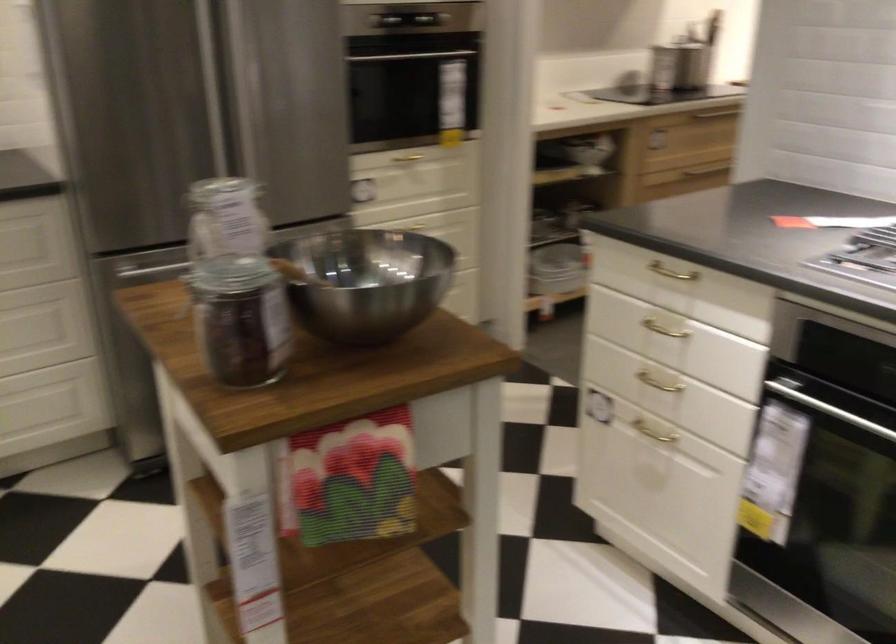
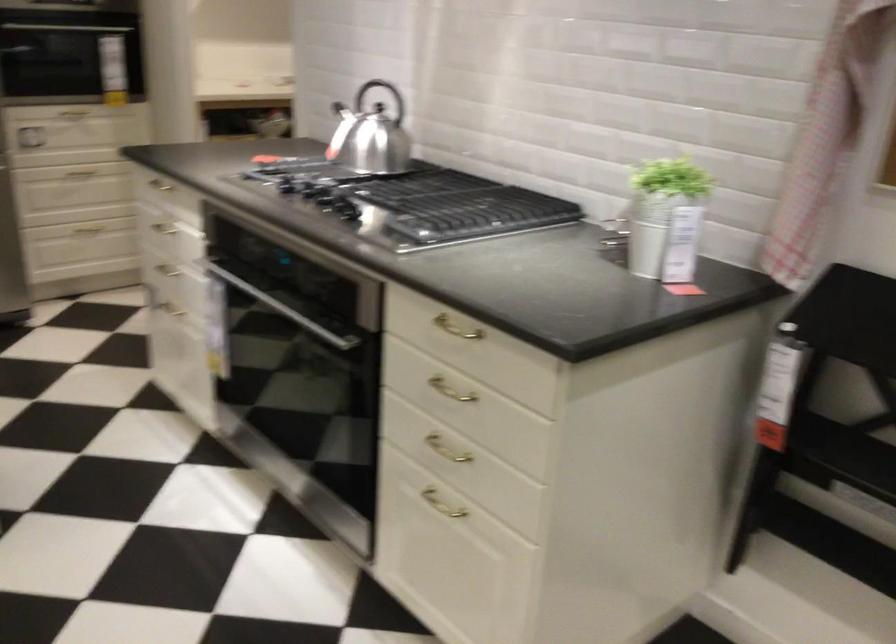
What movement of the cameraman would produce the second image?

The movement direction of the cameraman is right, backward.